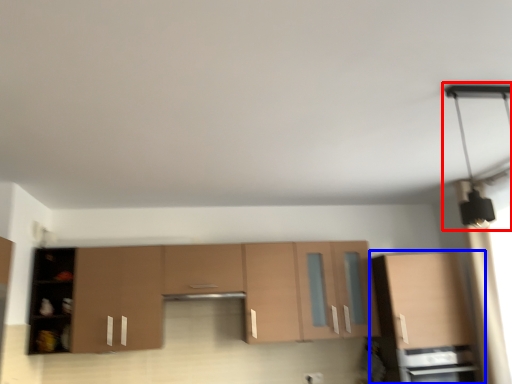
Question: Which object is further to the camera taking this photo, light fixture (highlighted by a red box) or cabinetry (highlighted by a blue box)?

Choices:
 (A) light fixture
 (B) cabinetry

Answer: (B)